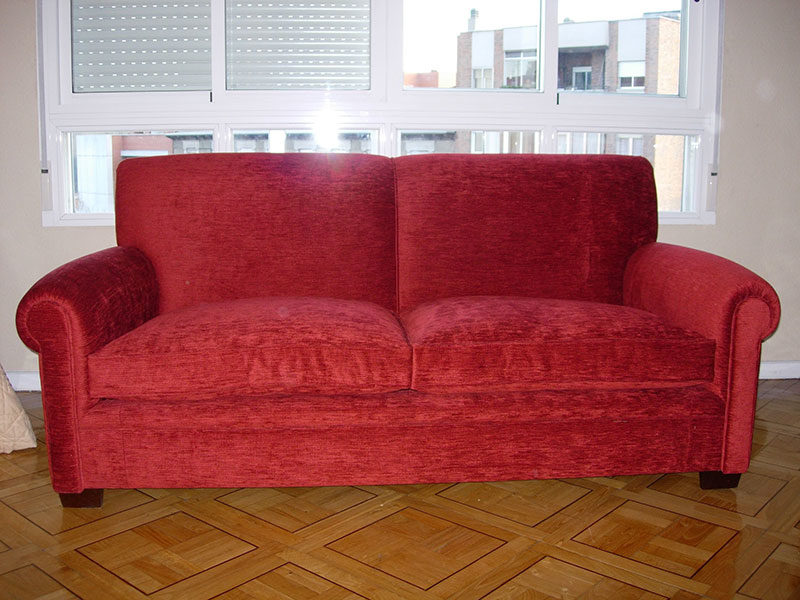
Where is `hope sofa`? hope sofa is located at coordinates (236, 275).